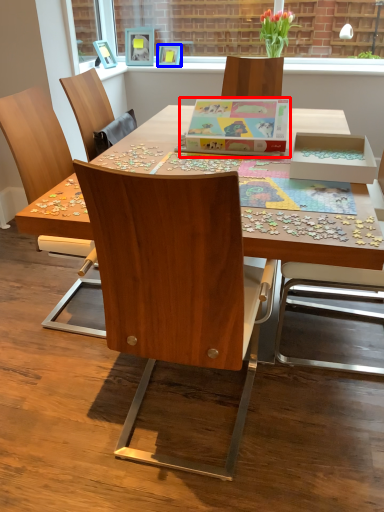
Question: Among these objects, which one is farthest to the camera, cardboard box (highlighted by a red box) or picture frame (highlighted by a blue box)?

Choices:
 (A) cardboard box
 (B) picture frame

Answer: (B)